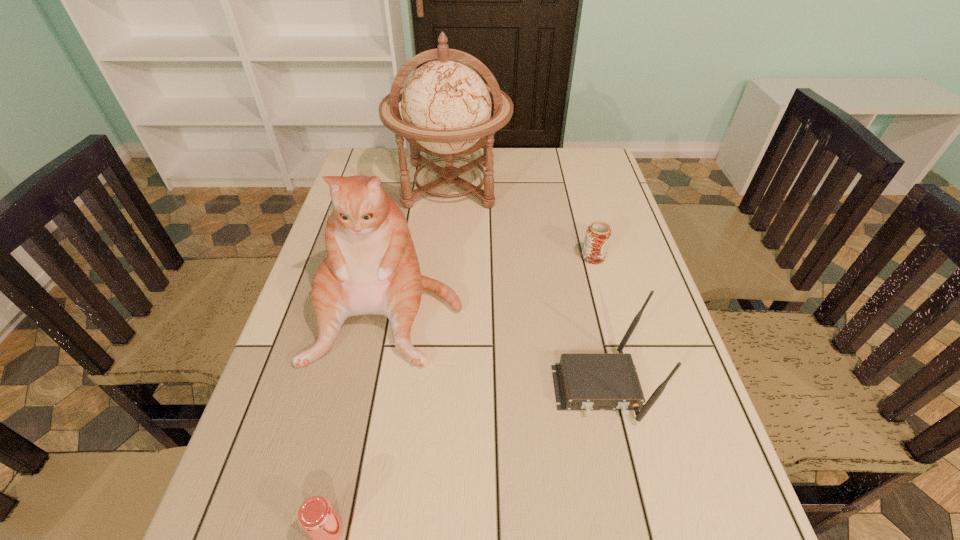
The image size is (960, 540). What are the coordinates of `globe located in the left edge section of the desktop` in the screenshot? It's located at (446, 106).

Where is `cat located in the left edge section of the desktop`? cat located in the left edge section of the desktop is located at coordinates (371, 267).

Where is `router positioned at the right edge`? The height and width of the screenshot is (540, 960). router positioned at the right edge is located at coordinates (583, 381).

Where is `beer can at the right edge`? The image size is (960, 540). beer can at the right edge is located at coordinates (598, 234).

Identify the location of object that is at the far left corner. Image resolution: width=960 pixels, height=540 pixels. (446, 106).

In the image, there is a desktop. Where is `vacant space at the left edge`? This screenshot has width=960, height=540. vacant space at the left edge is located at coordinates (288, 389).

This screenshot has height=540, width=960. In the image, there is a desktop. Identify the location of vacant space at the right edge. (639, 331).

Where is `vacant space at the far left corner of the desktop`? vacant space at the far left corner of the desktop is located at coordinates (396, 157).

This screenshot has height=540, width=960. I want to click on unoccupied area between the cat and the globe, so click(x=420, y=246).

Find the location of a particular element. vacant space that is in between the farther beer can and the globe is located at coordinates (522, 221).